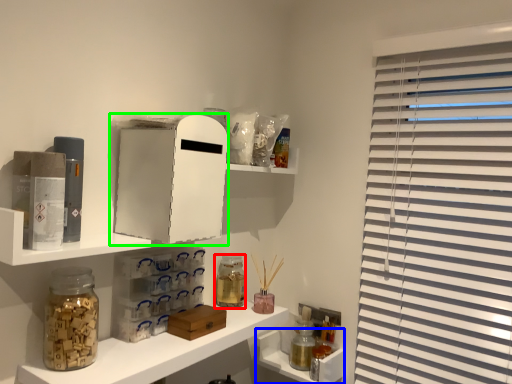
Question: Based on their relative distances, which object is nearer to bottle (highlighted by a red box)? Choose from cabinet (highlighted by a blue box) and medicine cabinet (highlighted by a green box).

Choices:
 (A) cabinet
 (B) medicine cabinet

Answer: (A)